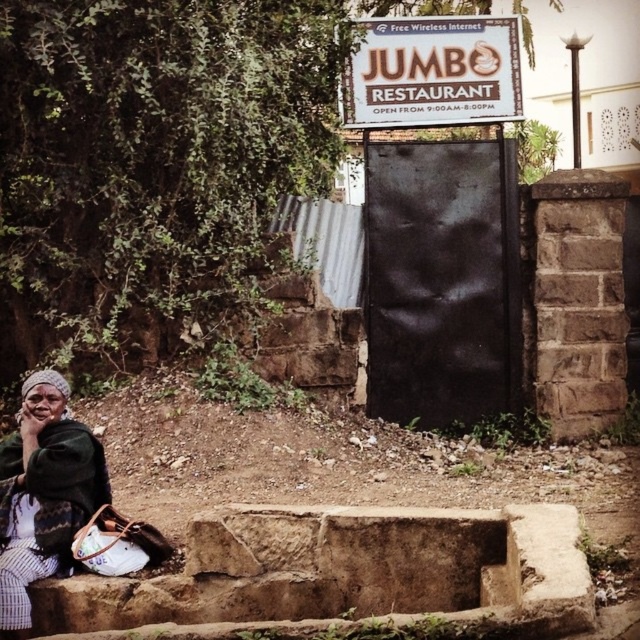
Looking at this image, you are a delivery person trying to place a package on the brown stone ledge at lower center. The package is 1.15 meters long. Can you fit the package horizontally on the ledge without overlapping the green woven fabric at lower left?

The brown stone ledge at lower center is 1.10 meters away from the green woven fabric at lower left. Since the package is 1.15 meters long, it is 0.05 meters longer than the available space between them. Therefore, the package cannot be placed horizontally on the ledge without overlapping the green woven fabric at lower left.

You are a delivery person who needs to place a package on the ground near the brown stone ledge at lower center and the green woven fabric at lower left. Which object should you place the package closer to if you want it to be on the right side of the scene?

The brown stone ledge at lower center is to the right of the green woven fabric at lower left, so placing the package closer to the brown stone ledge at lower center would position it on the right side of the scene.